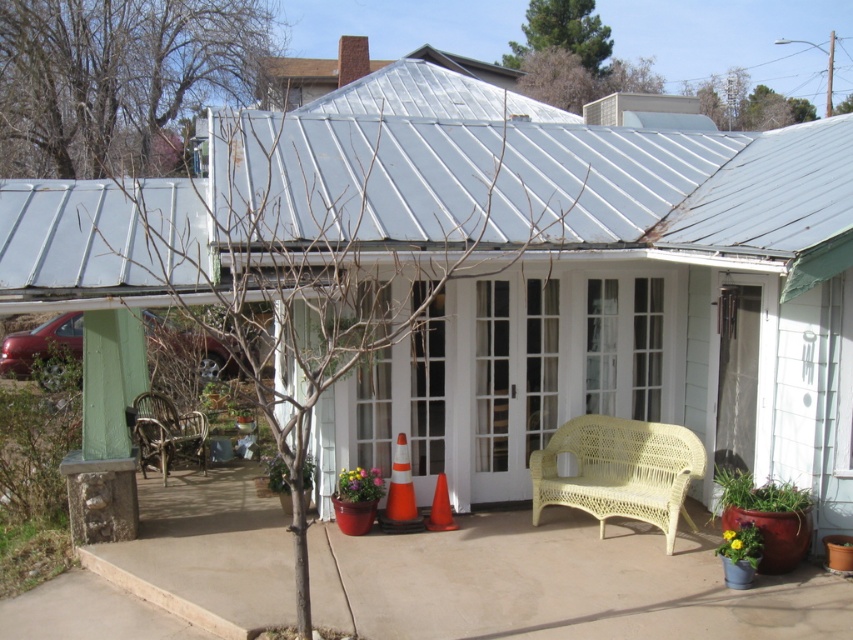
Question: Is yellow matte flower pot at lower right above green leafy plant at center?

Choices:
 (A) yes
 (B) no

Answer: (B)

Question: Which of the following is the closest to the observer?

Choices:
 (A) white wicker chair at center
 (B) orange/reflective traffic cone at center

Answer: (A)

Question: Is smooth concrete patio at lower center positioned behind orange/reflective traffic cone at center?

Choices:
 (A) yes
 (B) no

Answer: (B)

Question: Which point is closer to the camera?

Choices:
 (A) yellow matte flower pot at lower right
 (B) rattan chair at lower left
 (C) orange plastic cone at center

Answer: (A)

Question: Which of these objects is positioned farthest from the yellow matte flower pot at lower right?

Choices:
 (A) orange/reflective traffic cone at center
 (B) orange plastic cone at center

Answer: (A)

Question: In this image, where is white wicker chair at center located relative to green leafy plant at center?

Choices:
 (A) left
 (B) right

Answer: (B)